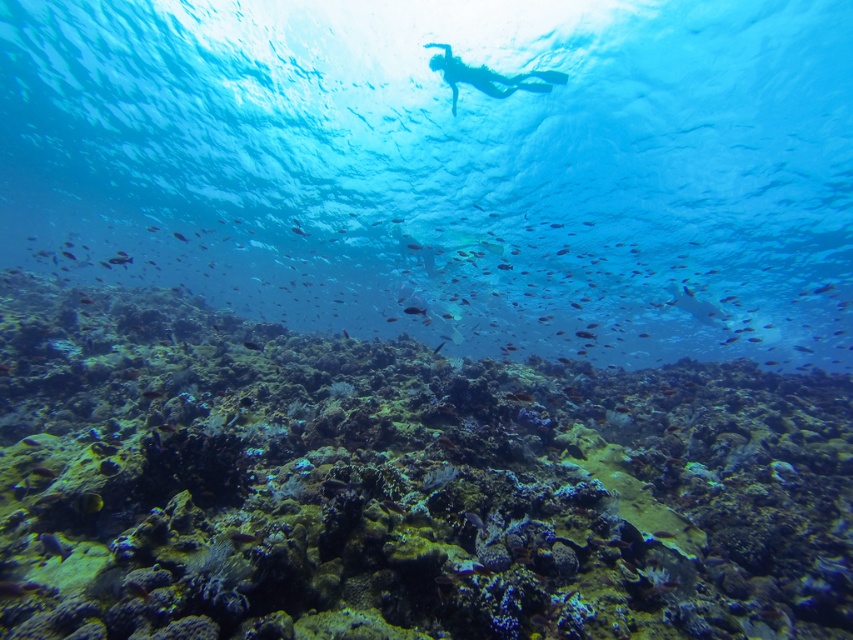
Who is higher up, transparent blue diver at upper center or shiny blue fish at center?

Positioned higher is transparent blue diver at upper center.

Who is positioned more to the right, transparent blue diver at upper center or shiny blue fish at center?

From the viewer's perspective, transparent blue diver at upper center appears more on the right side.

Is point (436, 42) less distant than point (473, 524)?

No, it is not.

At what (x,y) coordinates should I click in order to perform the action: click on transparent blue diver at upper center. Please return your answer as a coordinate pair (x, y). The image size is (853, 640). Looking at the image, I should click on (488, 76).

Where is `translucent blue water at center`? Image resolution: width=853 pixels, height=640 pixels. translucent blue water at center is located at coordinates (447, 168).

Can you confirm if translucent blue water at center is taller than rough textured coral reef at center?

Indeed, translucent blue water at center has a greater height compared to rough textured coral reef at center.

Which is in front, point (585, 140) or point (570, 384)?

Point (570, 384)

The width and height of the screenshot is (853, 640). What are the coordinates of `translucent blue water at center` in the screenshot? It's located at (447, 168).

Between translucent blue water at center and shiny yellow fish at lower left, which one is positioned lower?

shiny yellow fish at lower left

Can you confirm if translucent blue water at center is taller than shiny yellow fish at lower left?

Yes, translucent blue water at center is taller than shiny yellow fish at lower left.

Locate an element on the screen. Image resolution: width=853 pixels, height=640 pixels. translucent blue water at center is located at coordinates (447, 168).